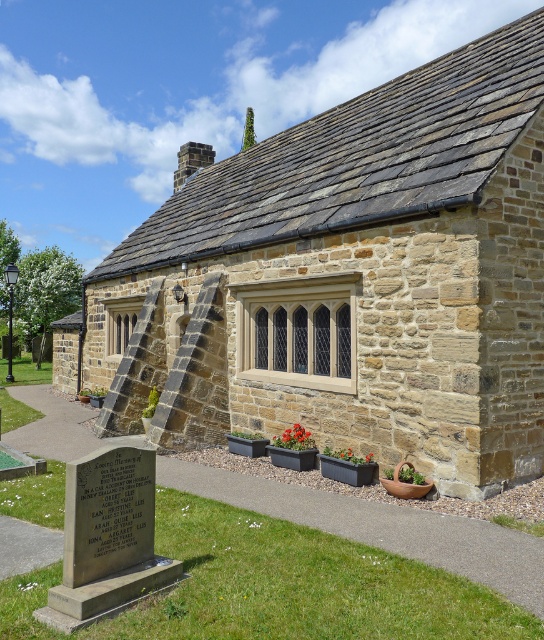
You are standing in a cemetery and see the stone textured cottage at center and the gray stone gravestone at lower left. Which object is positioned to the east of the other?

The stone textured cottage at center is to the right of the gray stone gravestone at lower left, so the cottage is positioned to the east of the gravestone.

You are standing in a cemetery and notice a stone textured cottage at center and a gray stone gravestone at lower left. Which object is taller?

The stone textured cottage at center is taller than the gray stone gravestone at lower left.

From the picture: You are standing in front of the stone building and notice two points marked on the image. The first point is at coordinate point [450,244] and the second is at point [65,620]. Which point is closer to you?

Point [65,620] is closer to you because it is in front of point [450,244].